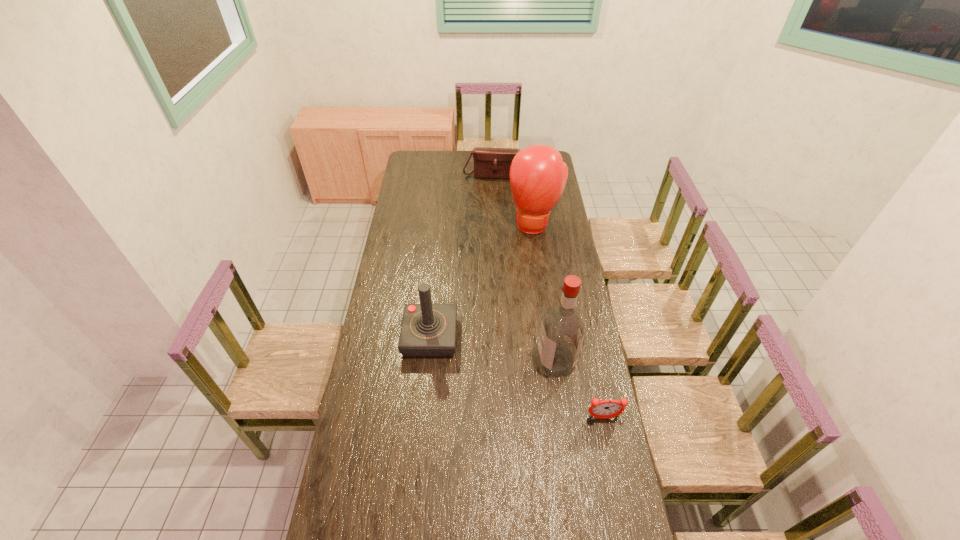
Image resolution: width=960 pixels, height=540 pixels. Find the location of `free space on the desktop that is between the joystick and the shortest object and is positioned on the striking surface of the boxing glove`. free space on the desktop that is between the joystick and the shortest object and is positioned on the striking surface of the boxing glove is located at coordinates (523, 380).

At what (x,y) coordinates should I click in order to perform the action: click on free space on the desktop that is between the third shortest object and the nearest object and is positioned on the front-facing side of the liquor. Please return your answer as a coordinate pair (x, y). This screenshot has width=960, height=540. Looking at the image, I should click on (494, 367).

At what (x,y) coordinates should I click in order to perform the action: click on free spot on the desktop that is between the third tallest object and the alarm clock and is positioned on the front flap of the shoulder bag. Please return your answer as a coordinate pair (x, y). This screenshot has height=540, width=960. Looking at the image, I should click on (493, 366).